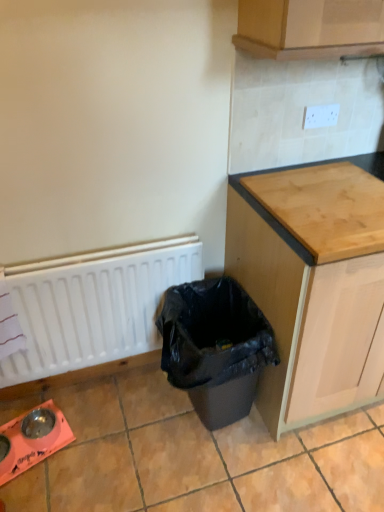
The width and height of the screenshot is (384, 512). In order to click on free area in between black plastic waste bin at lower center and white matte radiator at lower left in this screenshot , I will do `click(118, 421)`.